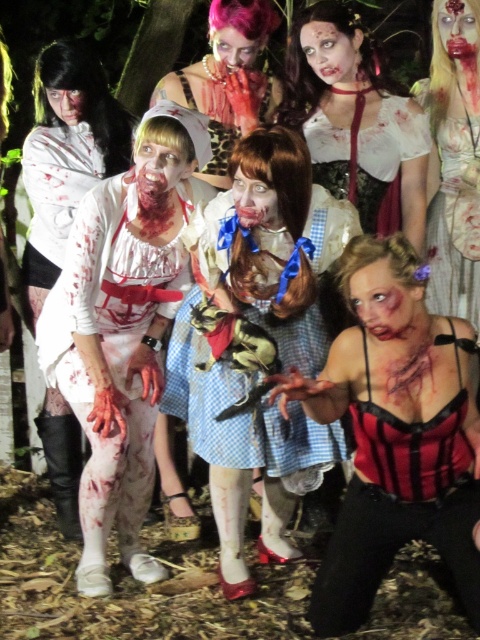
Question: Which of the following is the closest to the observer?

Choices:
 (A) white lace apron at left
 (B) shiny pink wig at upper center

Answer: (A)

Question: Is the position of white matte kimono at left less distant than that of matte white dress at center?

Choices:
 (A) yes
 (B) no

Answer: (A)

Question: Can you confirm if white lace apron at left is wider than blue plaid dress at center?

Choices:
 (A) no
 (B) yes

Answer: (A)

Question: Among these objects, which one is farthest from the camera?

Choices:
 (A) blue plaid dress at center
 (B) shiny pink wig at upper center

Answer: (B)

Question: Which is nearer to the shiny pink wig at upper center?

Choices:
 (A) white matte kimono at left
 (B) matte white blouse at upper center
 (C) matte white dress at center

Answer: (B)

Question: Does matte white blouse at upper center appear over matte white dress at center?

Choices:
 (A) yes
 (B) no

Answer: (A)